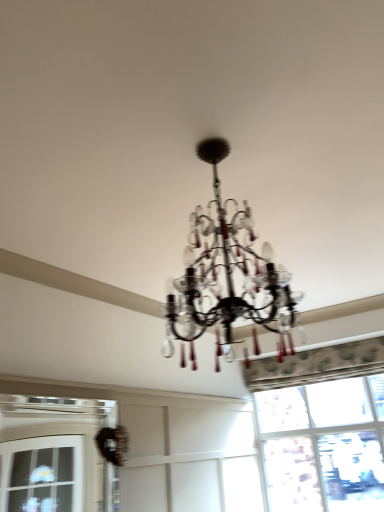
Question: From a real-world perspective, is transparent glass window at lower right, arranged as the 1th window when viewed from the right, positioned above or below clear glass window at lower left, the 1th window viewed from the front?

Choices:
 (A) above
 (B) below

Answer: (A)

Question: In terms of height, does transparent glass window at lower right, marked as the 2th window in a front-to-back arrangement, look taller or shorter compared to clear glass window at lower left, which appears as the second window when viewed from the right?

Choices:
 (A) tall
 (B) short

Answer: (A)

Question: Is transparent glass window at lower right, marked as the 2th window in a front-to-back arrangement, bigger or smaller than clear glass window at lower left, which appears as the second window when viewed from the back?

Choices:
 (A) small
 (B) big

Answer: (B)

Question: Considering the positions of clear glass window at lower left, the 1th window when ordered from left to right, and transparent glass window at lower right, marked as the 2th window in a front-to-back arrangement, in the image, is clear glass window at lower left, the 1th window when ordered from left to right, bigger or smaller than transparent glass window at lower right, marked as the 2th window in a front-to-back arrangement,?

Choices:
 (A) big
 (B) small

Answer: (B)

Question: Is clear glass window at lower left, the 1th window when ordered from left to right, in front of or behind transparent glass window at lower right, arranged as the 1th window when viewed from the right, in the image?

Choices:
 (A) behind
 (B) front

Answer: (B)

Question: Is clear glass window at lower left, the 1th window viewed from the front, wider or thinner than transparent glass window at lower right, arranged as the 1th window when viewed from the right?

Choices:
 (A) thin
 (B) wide

Answer: (A)

Question: From the image's perspective, is clear glass window at lower left, the 1th window viewed from the front, located above or below transparent glass window at lower right, which is the 2th window from left to right?

Choices:
 (A) above
 (B) below

Answer: (A)